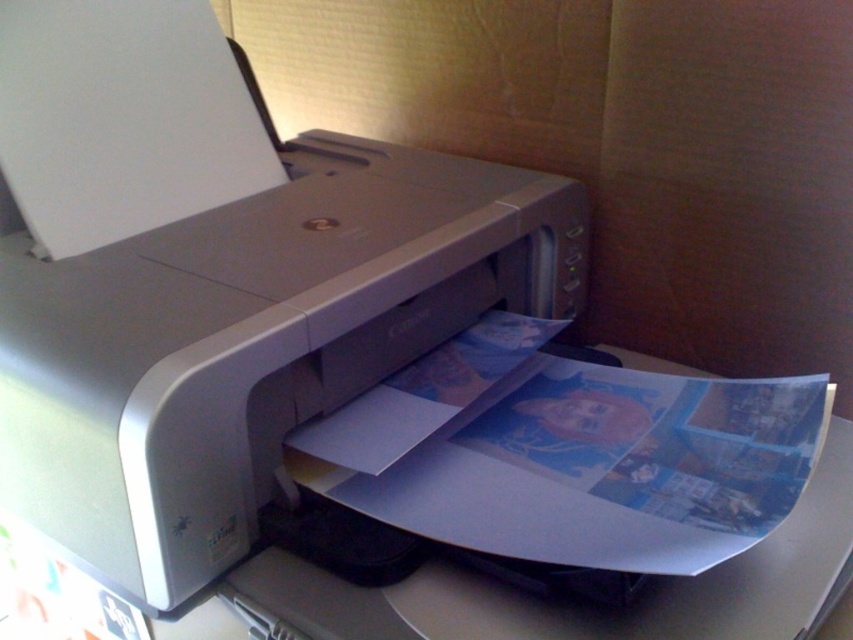
Question: Among these points, which one is nearest to the camera?

Choices:
 (A) (708, 401)
 (B) (216, 428)

Answer: (B)

Question: Does satin silver printer at center come behind glossy paper at center?

Choices:
 (A) no
 (B) yes

Answer: (B)

Question: Among these points, which one is farthest from the camera?

Choices:
 (A) (21, 132)
 (B) (700, 540)

Answer: (A)

Question: Is satin silver printer at center positioned at the back of glossy paper at center?

Choices:
 (A) yes
 (B) no

Answer: (A)

Question: Is satin silver printer at center smaller than glossy paper at center?

Choices:
 (A) yes
 (B) no

Answer: (B)